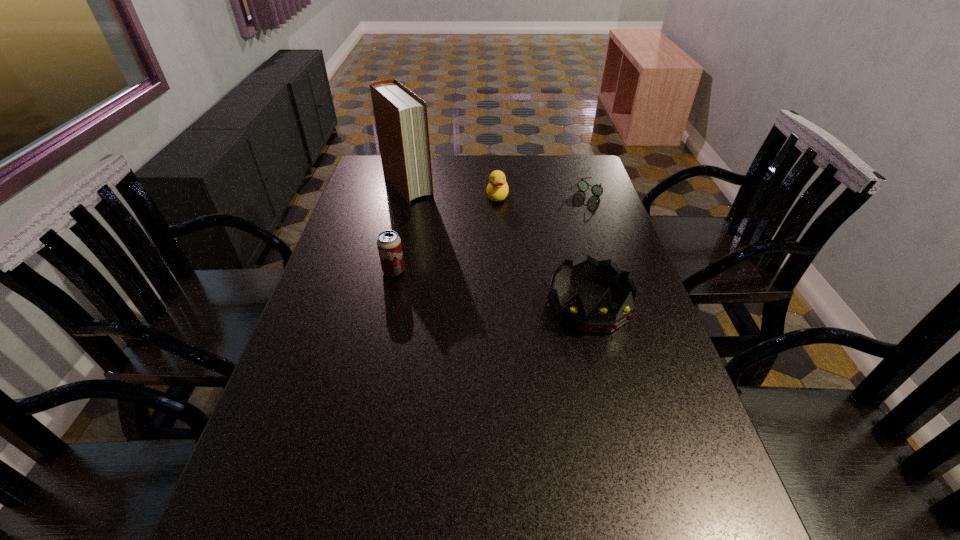
Identify the location of tiara that is at the right edge. The image size is (960, 540). (601, 319).

Image resolution: width=960 pixels, height=540 pixels. In order to click on spectacles located at the right edge in this screenshot , I will do `click(597, 190)`.

The width and height of the screenshot is (960, 540). Identify the location of object at the far left corner. point(401,118).

Find the location of a particular element. object at the far right corner is located at coordinates tap(597, 190).

The image size is (960, 540). In the image, there is a desktop. What are the coordinates of `vacant area at the far edge` in the screenshot? It's located at (520, 175).

Locate an element on the screen. This screenshot has width=960, height=540. blank space at the near edge is located at coordinates (500, 482).

Where is `vacant space at the left edge of the desktop`? vacant space at the left edge of the desktop is located at coordinates (343, 300).

Identify the location of free space at the right edge. (674, 362).

Identify the location of vacant area at the far left corner of the desktop. (382, 183).

Locate an element on the screen. vacant space at the near left corner of the desktop is located at coordinates (283, 497).